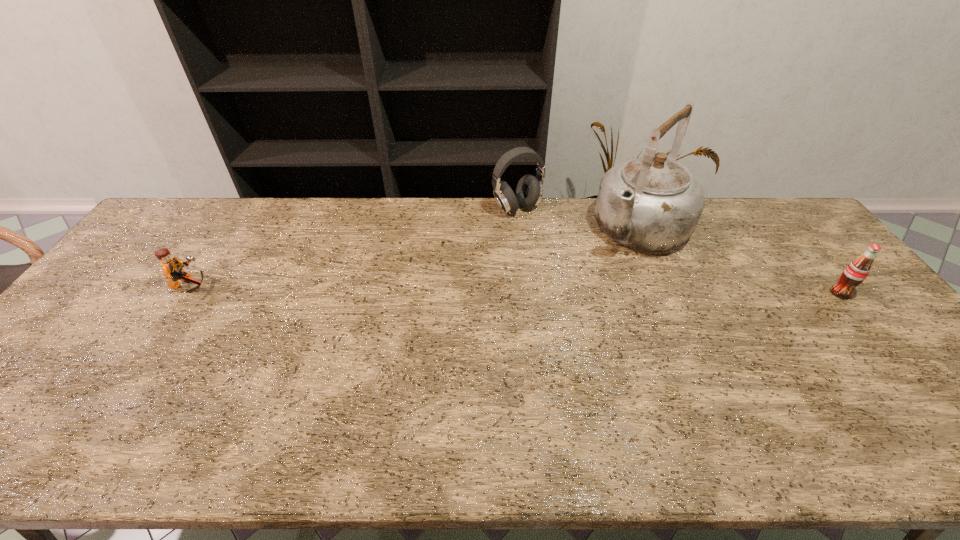
This screenshot has height=540, width=960. Find the location of `free space located on the ear cups of the second object from left to right`. free space located on the ear cups of the second object from left to right is located at coordinates (566, 274).

Where is `vacant space positioned on the ear cups of the second object from left to right`? This screenshot has height=540, width=960. vacant space positioned on the ear cups of the second object from left to right is located at coordinates (543, 242).

Find the location of a particular element. This screenshot has width=960, height=540. vacant space located 0.400m on the ear cups of the second object from left to right is located at coordinates (585, 300).

Where is `free spot located at the spout of the tallest object`? This screenshot has height=540, width=960. free spot located at the spout of the tallest object is located at coordinates (580, 298).

I want to click on blank space located 0.070m at the spout of the tallest object, so click(608, 268).

The image size is (960, 540). I want to click on free space located 0.070m at the spout of the tallest object, so click(608, 268).

Where is `headset at the far edge`? This screenshot has height=540, width=960. headset at the far edge is located at coordinates (529, 190).

Locate an element on the screen. This screenshot has width=960, height=540. kettle situated at the far edge is located at coordinates (650, 203).

At what (x,y) coordinates should I click in order to perform the action: click on object that is at the right edge. Please return your answer as a coordinate pair (x, y). The width and height of the screenshot is (960, 540). Looking at the image, I should click on (855, 273).

At what (x,y) coordinates should I click in order to perform the action: click on vacant area at the far edge. Please return your answer as a coordinate pair (x, y). This screenshot has height=540, width=960. Looking at the image, I should click on (289, 205).